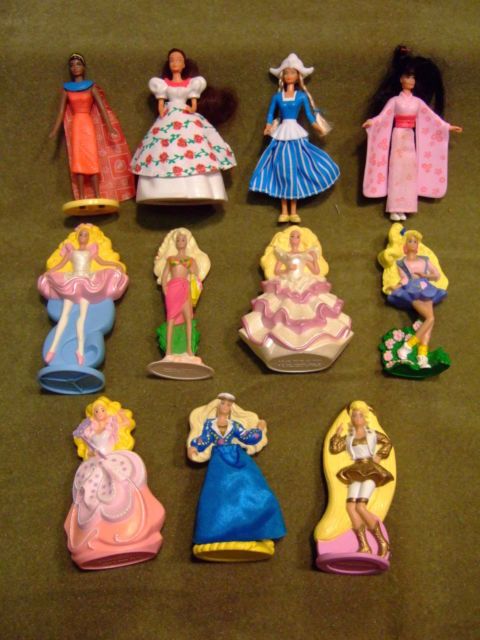
Locate an element on the screen. This screenshot has height=640, width=480. doll figurines is located at coordinates (135, 500), (367, 483), (420, 285), (324, 301), (178, 310), (103, 169), (82, 303), (168, 161), (277, 177), (394, 156).